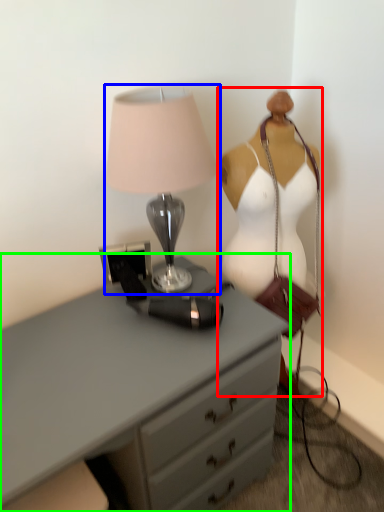
Question: Estimate the real-world distances between objects in this image. Which object is closer to mannequin (highlighted by a red box), lamp (highlighted by a blue box) or chest of drawers (highlighted by a green box)?

Choices:
 (A) lamp
 (B) chest of drawers

Answer: (A)